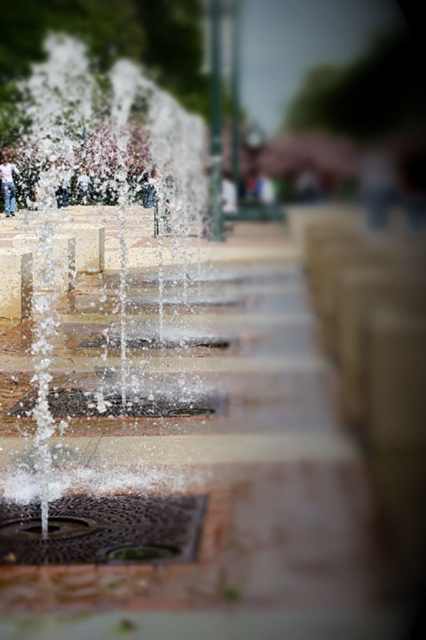
Question: Is clear water jets at center below denim jeans at left?

Choices:
 (A) no
 (B) yes

Answer: (B)

Question: Which of these objects is positioned farthest from the light blue jeans at center?

Choices:
 (A) denim jeans at left
 (B) clear water jets at center

Answer: (B)

Question: Which object is the farthest from the denim jeans at left?

Choices:
 (A) clear water jets at center
 (B) light blue jeans at center

Answer: (A)

Question: Which of the following is the farthest from the observer?

Choices:
 (A) (89, 157)
 (B) (5, 176)

Answer: (A)

Question: From the image, what is the correct spatial relationship of clear water jets at center in relation to light blue jeans at center?

Choices:
 (A) above
 (B) below

Answer: (B)

Question: Does clear water jets at center appear over light blue jeans at center?

Choices:
 (A) no
 (B) yes

Answer: (A)